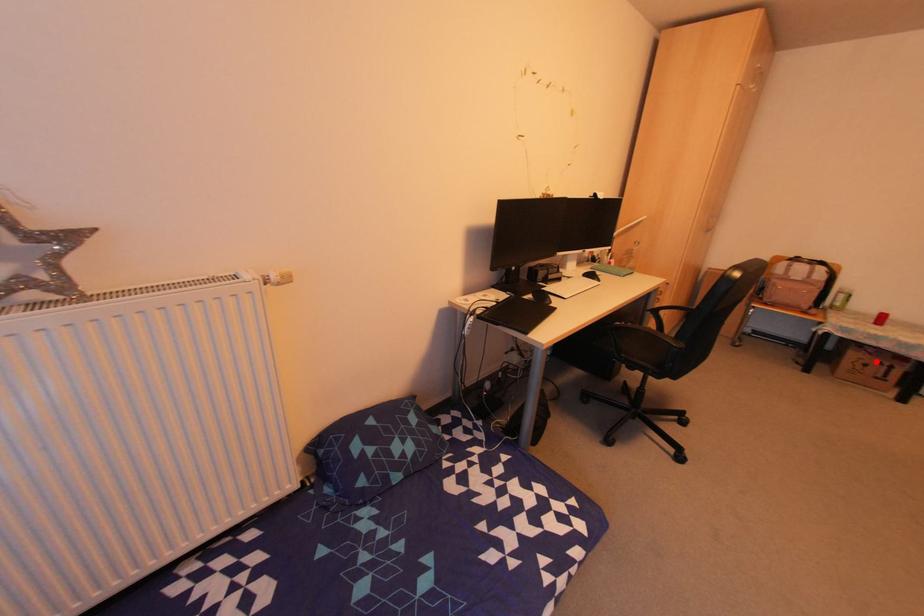
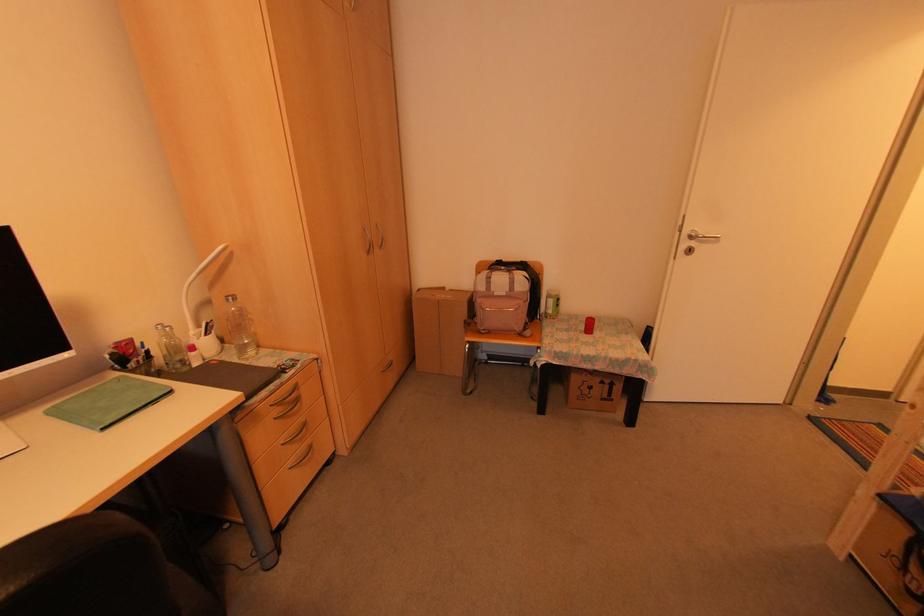
Find the pixel in the second image that matches the highlighted location in the first image.

(598, 381)